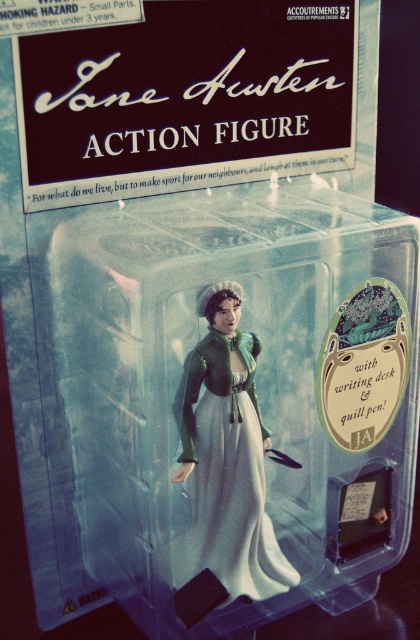
Question: Can you confirm if transparent plastic action figure at center is smaller than matte green fabric dress at center?

Choices:
 (A) yes
 (B) no

Answer: (B)

Question: Which object appears farthest from the camera in this image?

Choices:
 (A) matte green fabric dress at center
 (B) transparent plastic action figure at center

Answer: (A)

Question: Which object is closer to the camera taking this photo?

Choices:
 (A) transparent plastic action figure at center
 (B) matte green fabric dress at center

Answer: (A)

Question: Can you confirm if transparent plastic action figure at center is positioned above matte green fabric dress at center?

Choices:
 (A) yes
 (B) no

Answer: (A)

Question: In this image, where is transparent plastic action figure at center located relative to matte green fabric dress at center?

Choices:
 (A) left
 (B) right

Answer: (B)